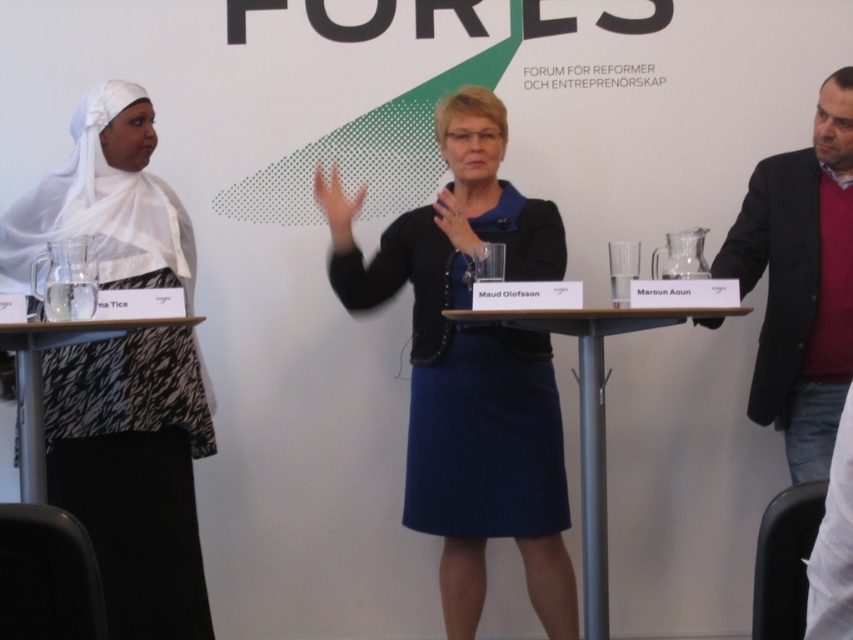
Question: Is blue fabric skirt at center positioned behind dark gray blazer at right?

Choices:
 (A) no
 (B) yes

Answer: (B)

Question: Which point is farther to the camera?

Choices:
 (A) (181, 493)
 (B) (358, 200)
 (C) (589, 586)

Answer: (B)

Question: Which object is farther from the camera taking this photo?

Choices:
 (A) blue fabric skirt at center
 (B) zebra-patterned fabric at left

Answer: (A)

Question: Does wooden table at center have a lesser width compared to zebra-patterned fabric at left?

Choices:
 (A) no
 (B) yes

Answer: (A)

Question: Does dark gray blazer at right appear on the left side of wooden table at center?

Choices:
 (A) yes
 (B) no

Answer: (B)

Question: Which object appears closest to the camera in this image?

Choices:
 (A) wooden table at center
 (B) white silk hijab at left
 (C) zebra-patterned fabric at left
 (D) dark gray blazer at right

Answer: (C)